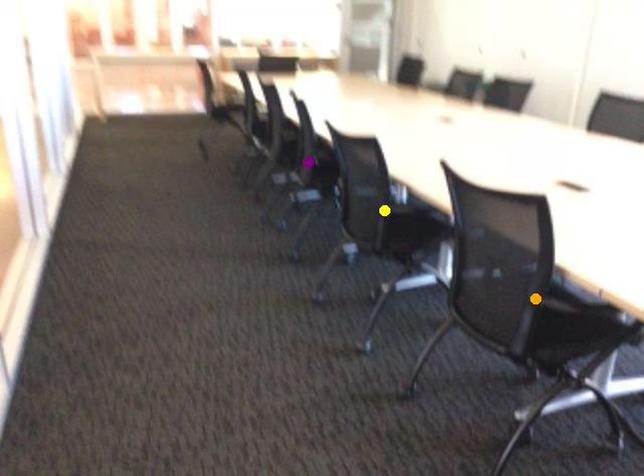
In the scene shown: Order these from nearest to farthest:
yellow point | orange point | purple point

1. orange point
2. yellow point
3. purple point